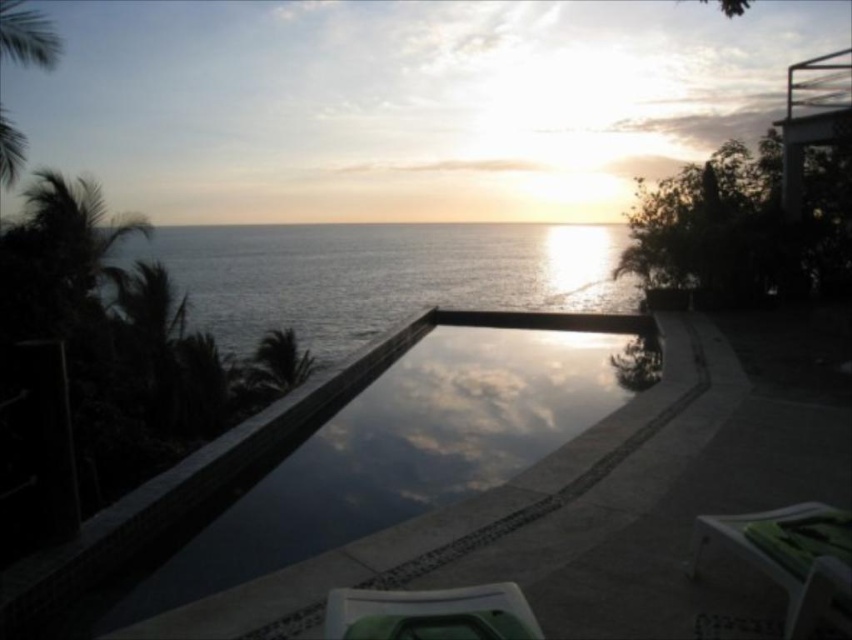
Between smooth concrete pool at center and green plastic chair at lower right, which one has more height?

With more height is smooth concrete pool at center.

Does smooth concrete pool at center have a smaller size compared to green plastic chair at lower right?

Incorrect, smooth concrete pool at center is not smaller in size than green plastic chair at lower right.

Locate an element on the screen. The width and height of the screenshot is (852, 640). smooth concrete pool at center is located at coordinates (407, 449).

Which is above, green plastic chair at lower right or green plastic chair at lower center?

Positioned higher is green plastic chair at lower center.

Does green plastic chair at lower right have a smaller size compared to green plastic chair at lower center?

No, green plastic chair at lower right is not smaller than green plastic chair at lower center.

Looking at this image, who is more forward, (740, 552) or (484, 586)?

Positioned in front is point (484, 586).

This screenshot has height=640, width=852. What are the coordinates of `green plastic chair at lower right` in the screenshot? It's located at (790, 556).

Is point (514, 435) in front of point (274, 360)?

Yes, it is.

Between smooth concrete pool at center and green leafy palm tree at left, which one appears on the right side from the viewer's perspective?

smooth concrete pool at center

Locate an element on the screen. This screenshot has height=640, width=852. smooth concrete pool at center is located at coordinates (407, 449).